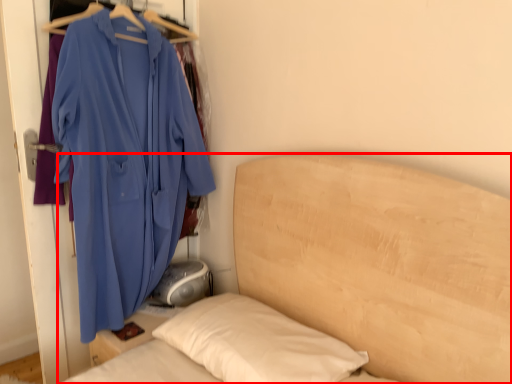
Question: Where is bed (annotated by the red box) located in relation to jacket in the image?

Choices:
 (A) left
 (B) right

Answer: (B)